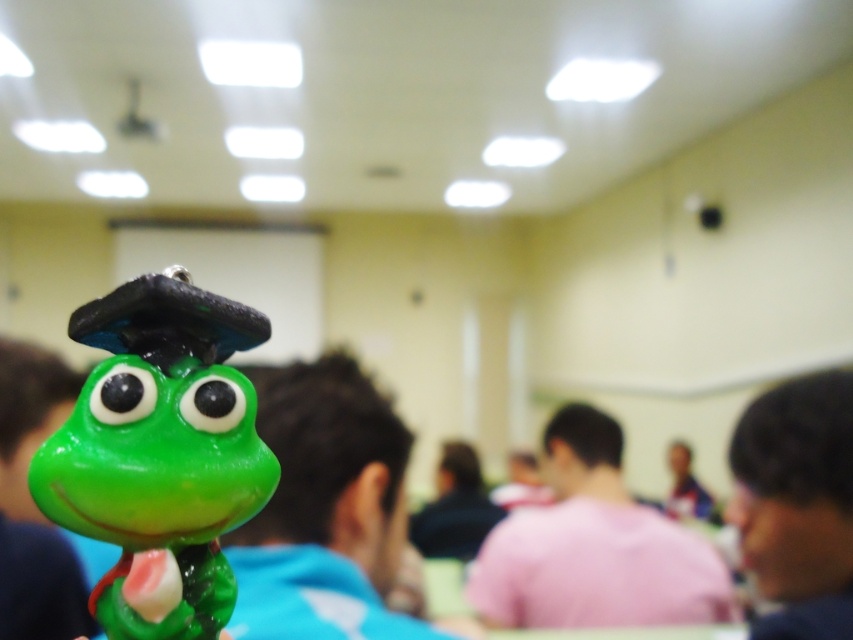
Question: Does green matte plastic frog at center have a lesser width compared to pink matte shirt at center?

Choices:
 (A) yes
 (B) no

Answer: (A)

Question: Which object appears closest to the camera in this image?

Choices:
 (A) dark brown hair at lower right
 (B) green matte plastic frog at center

Answer: (B)

Question: Does green matte plastic frog at center appear under dark brown hair at lower right?

Choices:
 (A) no
 (B) yes

Answer: (A)

Question: Is green matte plastic frog at center wider than dark brown hair at lower right?

Choices:
 (A) no
 (B) yes

Answer: (A)

Question: Which object is closer to the camera taking this photo?

Choices:
 (A) pink matte shirt at center
 (B) green matte plastic frog at center
 (C) dark brown hair at lower right

Answer: (B)

Question: Which object appears farthest from the camera in this image?

Choices:
 (A) dark brown hair at lower right
 (B) pink matte shirt at center
 (C) green matte plastic frog at center

Answer: (B)